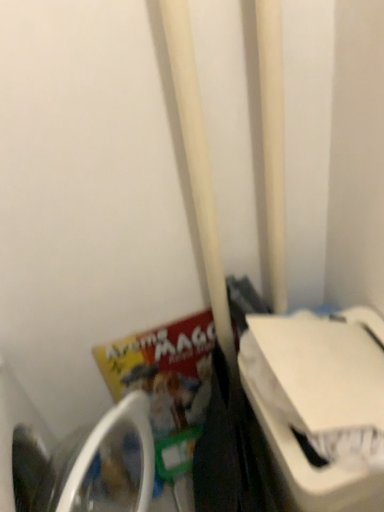
Question: Does white matte pole at center appear on the left side of white plastic washing machine at lower left, arranged as the second washing machine when viewed from the right?

Choices:
 (A) yes
 (B) no

Answer: (B)

Question: From the image's perspective, is white matte pole at center over white plastic washing machine at lower left, arranged as the second washing machine when viewed from the right?

Choices:
 (A) no
 (B) yes

Answer: (B)

Question: Are white matte pole at center and white plastic washing machine at lower left, arranged as the second washing machine when viewed from the right, far apart?

Choices:
 (A) no
 (B) yes

Answer: (A)

Question: Does white matte pole at center lie behind white plastic washing machine at lower left, which appears as the 1th washing machine when viewed from the left?

Choices:
 (A) yes
 (B) no

Answer: (A)

Question: Does white matte pole at center have a greater width compared to white plastic washing machine at lower left, which appears as the 1th washing machine when viewed from the left?

Choices:
 (A) yes
 (B) no

Answer: (B)

Question: Can you confirm if white matte pole at center is smaller than white plastic washing machine at lower left, arranged as the second washing machine when viewed from the right?

Choices:
 (A) no
 (B) yes

Answer: (B)

Question: Does white plastic washing machine at right, arranged as the second washing machine when viewed from the left, appear on the right side of matte paper book at lower left?

Choices:
 (A) no
 (B) yes

Answer: (B)

Question: Does white plastic washing machine at right, arranged as the second washing machine when viewed from the left, have a smaller size compared to matte paper book at lower left?

Choices:
 (A) yes
 (B) no

Answer: (B)

Question: Is the surface of white plastic washing machine at right, arranged as the second washing machine when viewed from the left, in direct contact with matte paper book at lower left?

Choices:
 (A) yes
 (B) no

Answer: (B)

Question: Considering the relative sizes of white plastic washing machine at right, arranged as the second washing machine when viewed from the left, and matte paper book at lower left in the image provided, is white plastic washing machine at right, arranged as the second washing machine when viewed from the left, thinner than matte paper book at lower left?

Choices:
 (A) yes
 (B) no

Answer: (B)

Question: Is white plastic washing machine at right, arranged as the second washing machine when viewed from the left, taller than matte paper book at lower left?

Choices:
 (A) yes
 (B) no

Answer: (A)

Question: Does white plastic washing machine at right, arranged as the second washing machine when viewed from the left, have a lesser height compared to matte paper book at lower left?

Choices:
 (A) yes
 (B) no

Answer: (B)

Question: From a real-world perspective, is white plastic washing machine at lower left, which appears as the 1th washing machine when viewed from the left, positioned under white plastic washing machine at right, which ranks as the 1th washing machine in right-to-left order, based on gravity?

Choices:
 (A) yes
 (B) no

Answer: (B)